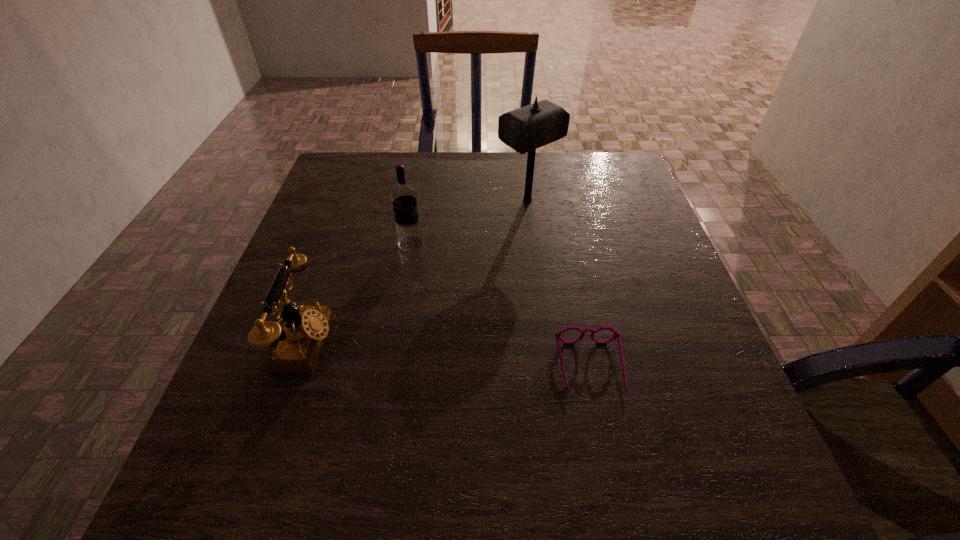
I want to click on free location located on the arms of the shortest object, so click(606, 441).

Image resolution: width=960 pixels, height=540 pixels. I want to click on object that is at the far edge, so click(525, 129).

Locate an element on the screen. The width and height of the screenshot is (960, 540). object that is at the left edge is located at coordinates (298, 342).

Locate an element on the screen. Image resolution: width=960 pixels, height=540 pixels. vacant space at the far edge of the desktop is located at coordinates (489, 152).

Find the location of a particular element. This screenshot has width=960, height=540. vacant space at the left edge of the desktop is located at coordinates (290, 404).

This screenshot has height=540, width=960. In order to click on free space at the right edge in this screenshot , I will do `click(757, 453)`.

What are the coordinates of `free region at the far left corner` in the screenshot? It's located at (381, 163).

The image size is (960, 540). I want to click on vacant space at the near left corner of the desktop, so click(x=229, y=468).

The image size is (960, 540). Identify the location of vacant space that's between the farthest object and the spectacles. (559, 284).

This screenshot has height=540, width=960. I want to click on unoccupied area between the third object from right to left and the farthest object, so click(x=468, y=221).